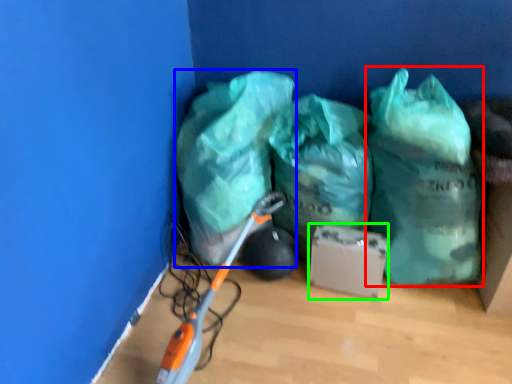
Question: Based on their relative distances, which object is nearer to plastic bag (highlighted by a red box)? Choose from plastic bag (highlighted by a blue box) and cardboard box (highlighted by a green box).

Choices:
 (A) plastic bag
 (B) cardboard box

Answer: (B)